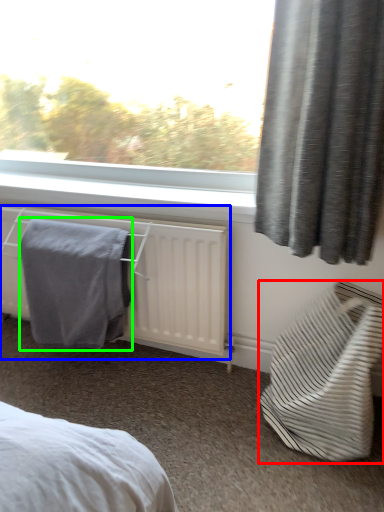
Question: Which object is the farthest from furniture (highlighted by a red box)? Choose among these: radiator (highlighted by a blue box) or bath towel (highlighted by a green box).

Choices:
 (A) radiator
 (B) bath towel

Answer: (B)